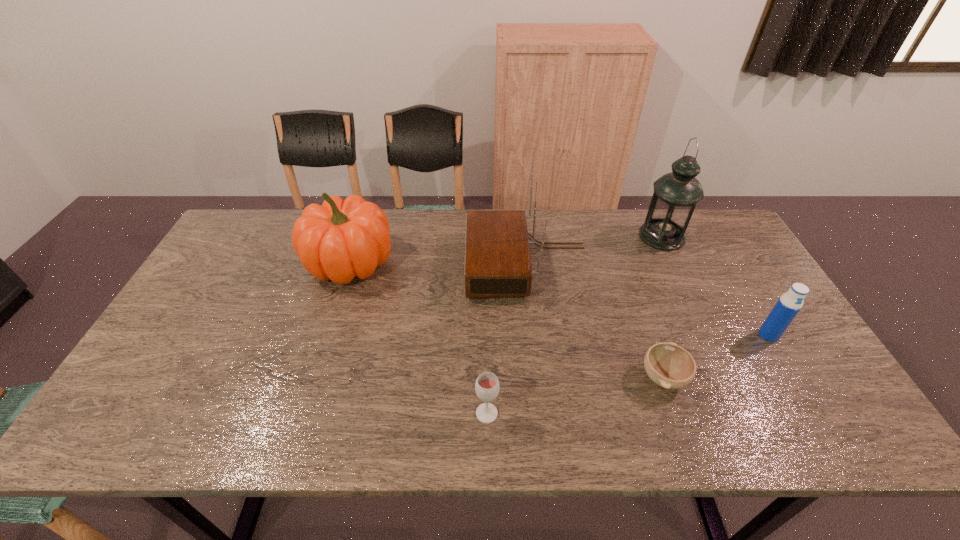
This screenshot has width=960, height=540. I want to click on bowl, so click(x=668, y=365).

Where is `vacant point located 0.360m on the left of the second object from right to left`? The image size is (960, 540). vacant point located 0.360m on the left of the second object from right to left is located at coordinates (532, 237).

You are a GUI agent. You are given a task and a screenshot of the screen. Output one action in this format:
    pyautogui.click(x=<x>, y=<y>)
    Task: Click on the vacant space located on the front panel of the radio_receiver
    
    Given the screenshot: What is the action you would take?
    pyautogui.click(x=396, y=264)

You are a GUI agent. You are given a task and a screenshot of the screen. Output one action in this format:
    pyautogui.click(x=<x>, y=<y>)
    Task: Click on the free point located on the front panel of the radio_receiver
    
    Given the screenshot: What is the action you would take?
    pyautogui.click(x=351, y=264)

Where is `vacant region located 0.270m on the front panel of the radio_receiver`? vacant region located 0.270m on the front panel of the radio_receiver is located at coordinates (380, 264).

Image resolution: width=960 pixels, height=540 pixels. Identify the location of free spot located on the right of the leftmost object. (424, 262).

Find the location of a particular element. free space located 0.150m on the left of the fourth tallest object is located at coordinates (703, 335).

This screenshot has width=960, height=540. I want to click on vacant space located 0.090m on the back of the fifth tallest object, so click(x=487, y=371).

What are the coordinates of `free location located 0.310m on the left of the bowl` in the screenshot? It's located at (514, 377).

This screenshot has width=960, height=540. I want to click on oil lamp that is at the far edge, so click(x=676, y=194).